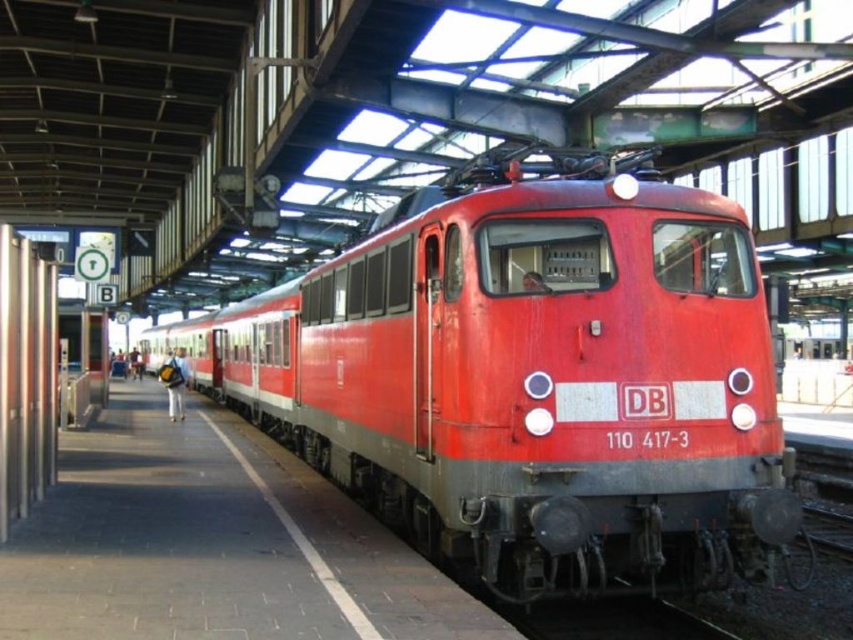
Question: Does matte red train at center appear on the left side of smooth concrete platform at center?

Choices:
 (A) no
 (B) yes

Answer: (A)

Question: Does matte red train at center appear on the left side of smooth concrete platform at center?

Choices:
 (A) yes
 (B) no

Answer: (B)

Question: Can you confirm if matte red train at center is positioned to the right of smooth concrete platform at center?

Choices:
 (A) yes
 (B) no

Answer: (A)